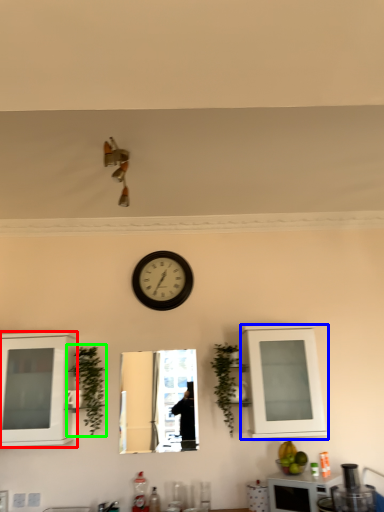
Question: Based on their relative distances, which object is farther from cabinetry (highlighted by a red box)? Choose from cabinetry (highlighted by a blue box) and plant (highlighted by a green box).

Choices:
 (A) cabinetry
 (B) plant

Answer: (A)